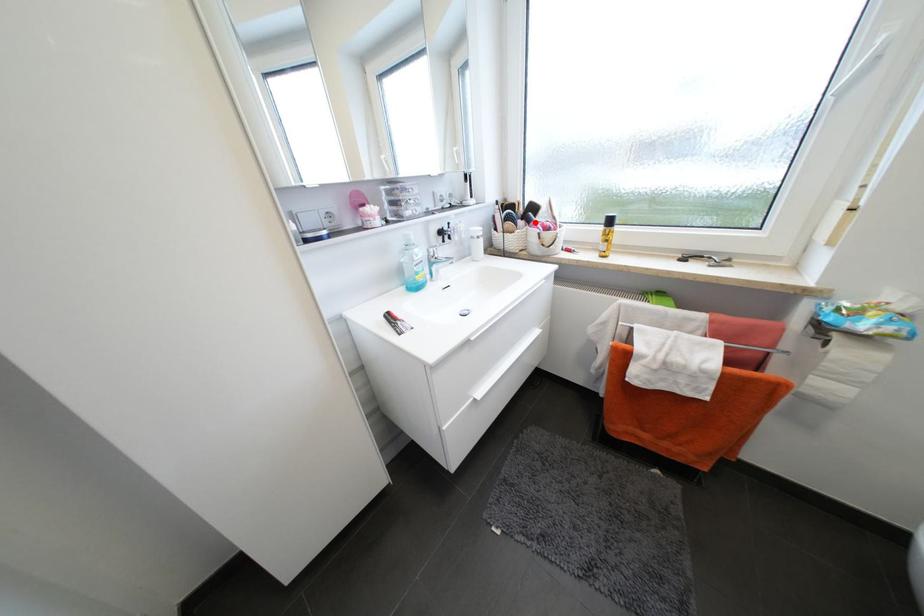
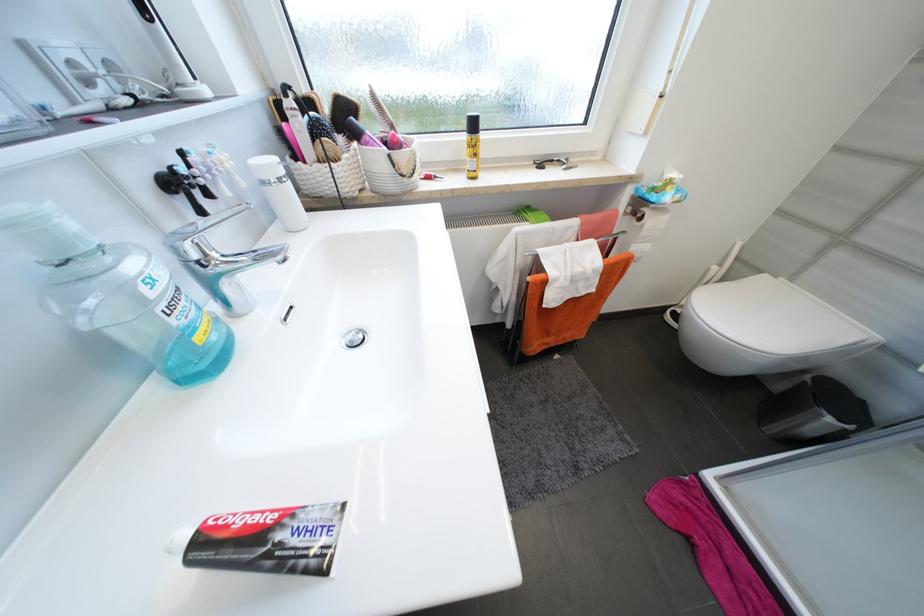
In the second image, find the point that corresponds to the highlighted location in the first image.

(362, 136)